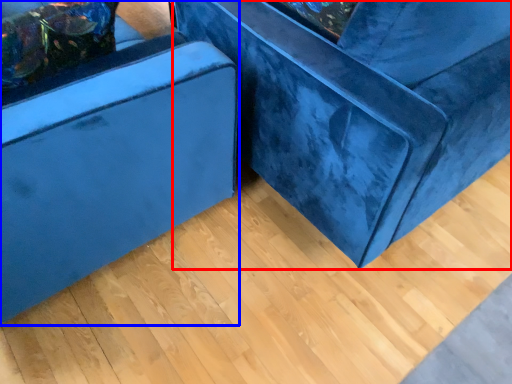
Question: Which of the following is the closest to the observer, furniture (highlighted by a red box) or furniture (highlighted by a blue box)?

Choices:
 (A) furniture
 (B) furniture

Answer: (B)